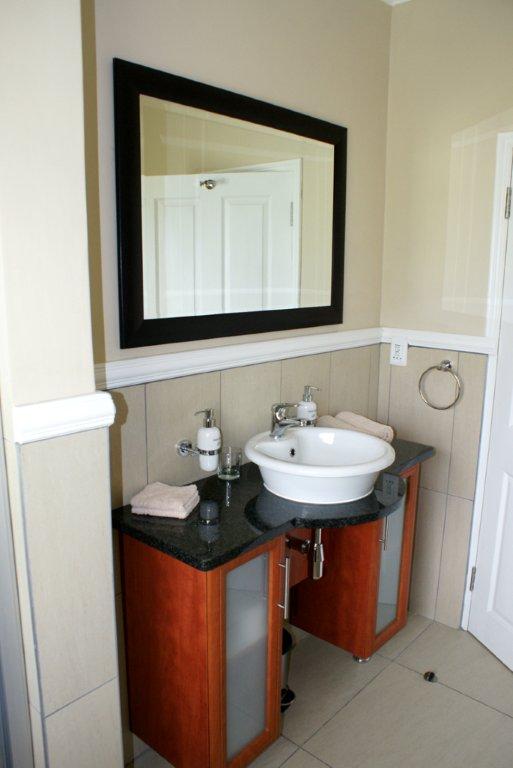
The image size is (513, 768). What are the coordinates of `soap` in the screenshot? It's located at (210, 439).